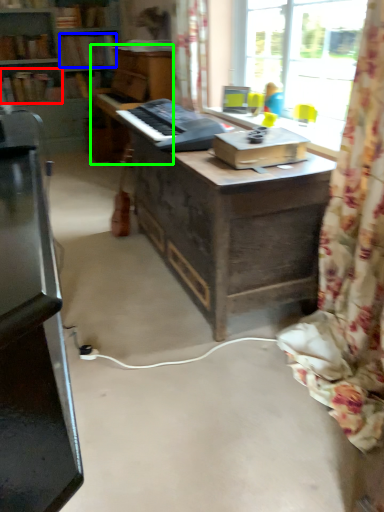
Question: Which is nearer to the book (highlighted by a red box)? book (highlighted by a blue box) or piano (highlighted by a green box).

Choices:
 (A) book
 (B) piano

Answer: (A)